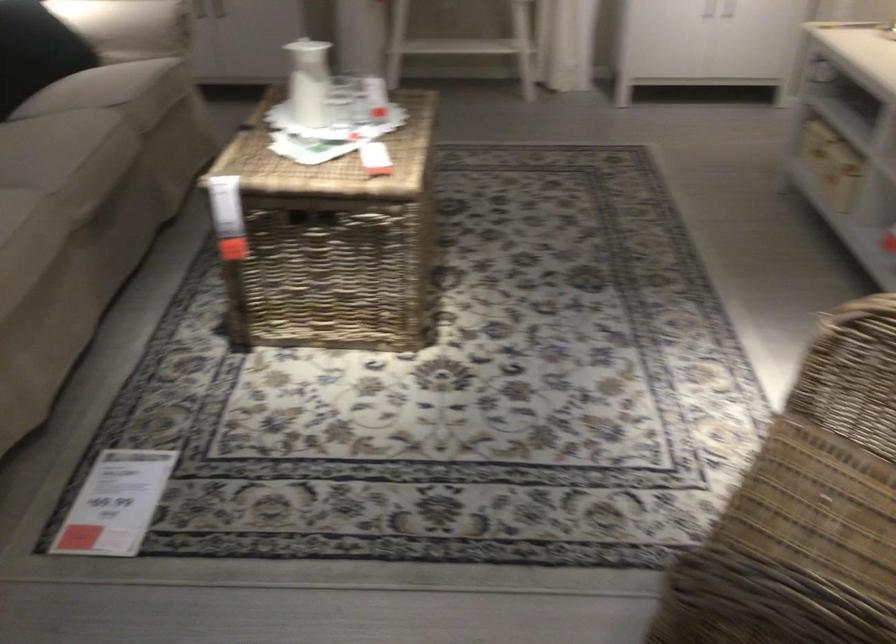
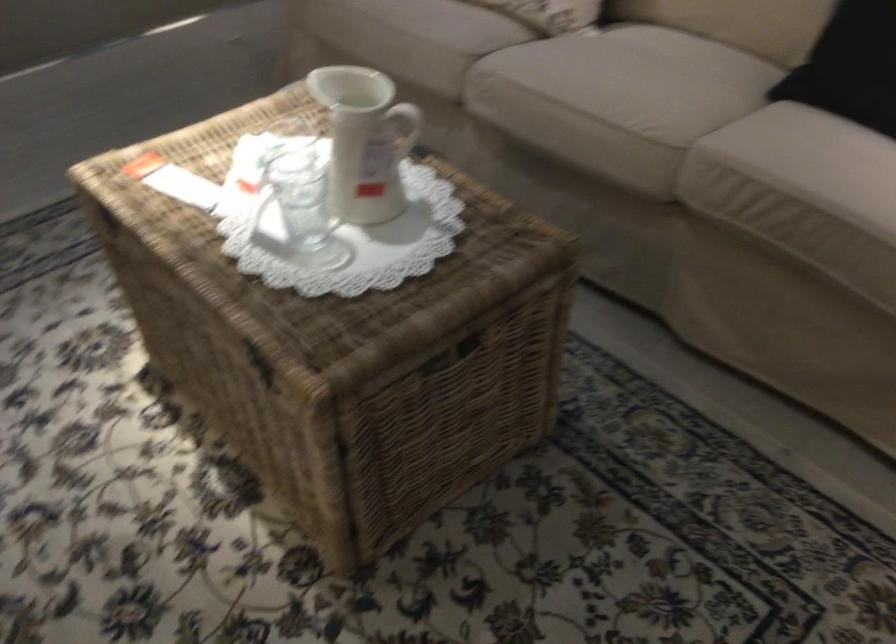
In the second image, find the point that corresponds to the point at 80,135 in the first image.

(617, 93)